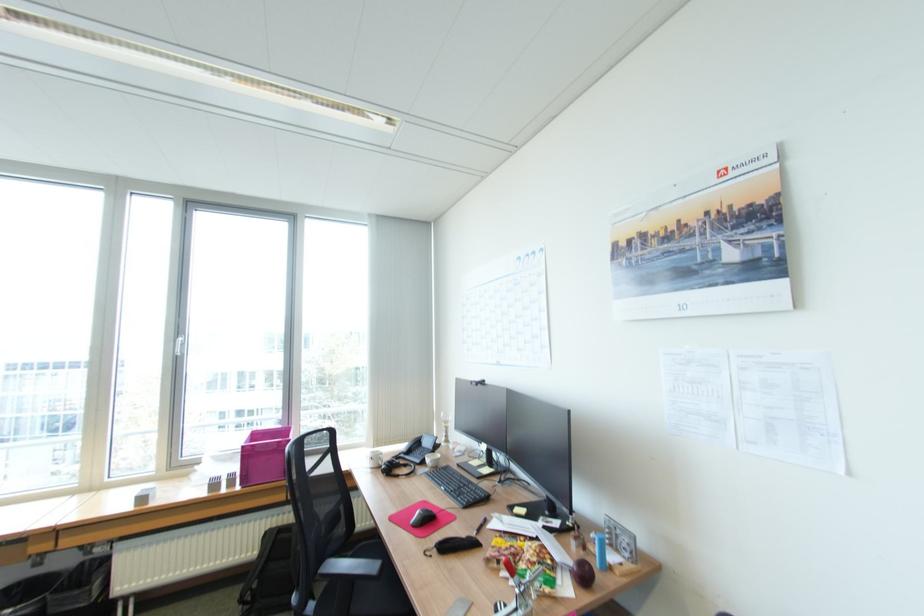
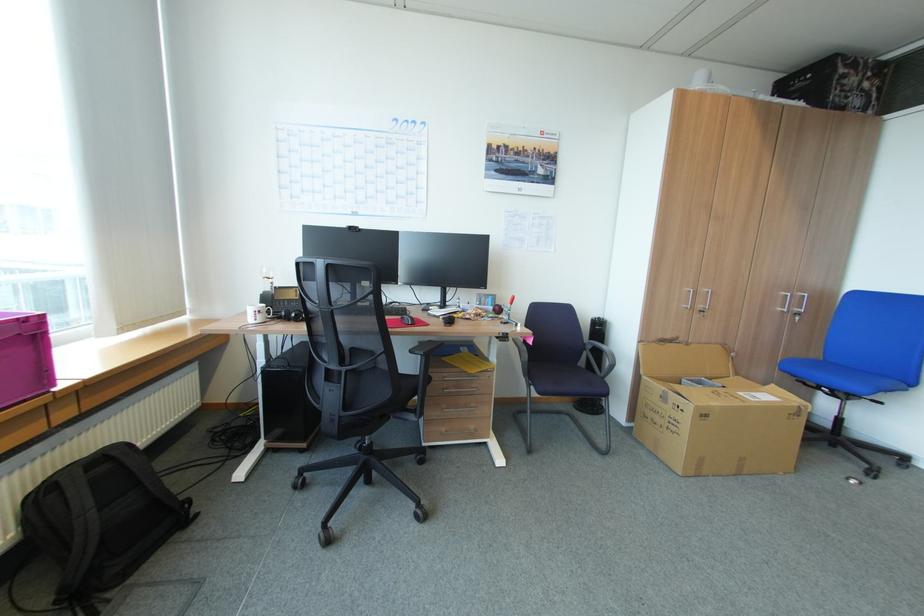
The point at (273, 561) is marked in the first image. Where is the corresponding point in the second image?

(103, 511)